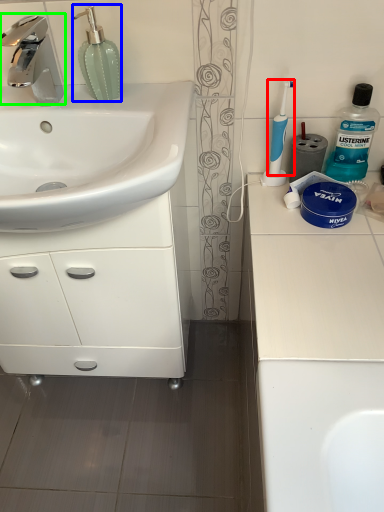
Question: Considering the real-world distances, which object is farthest from toothbrush (highlighted by a red box)? soap dispenser (highlighted by a blue box) or tap (highlighted by a green box)?

Choices:
 (A) soap dispenser
 (B) tap

Answer: (B)